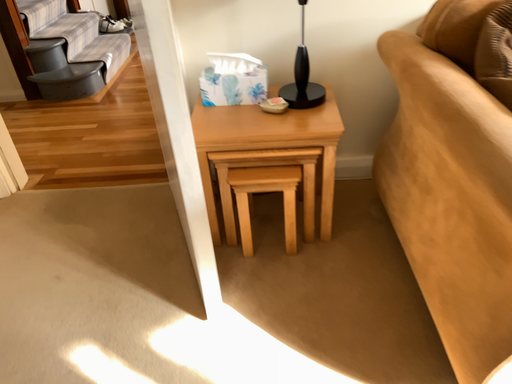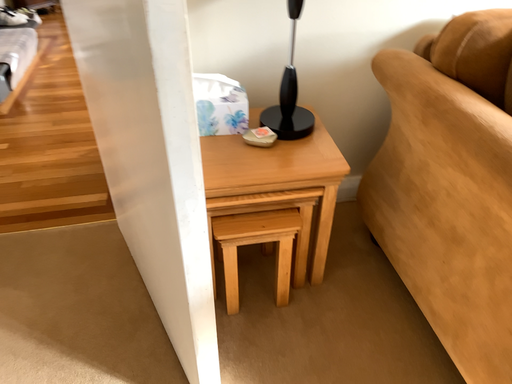
Question: Which way did the camera rotate in the video?

Choices:
 (A) rotated right
 (B) rotated left

Answer: (A)